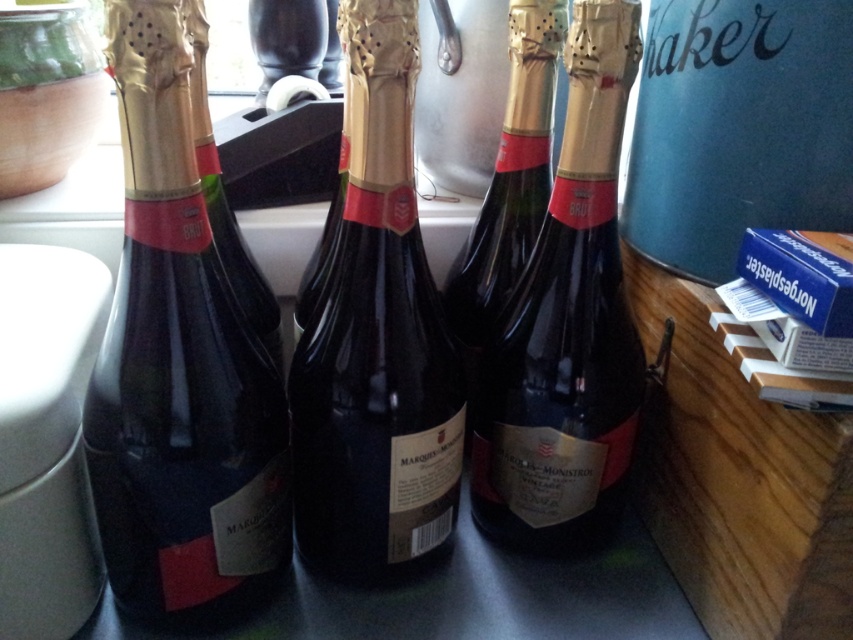
Between matte black bottle at left and matte gold foil champagne bottle at center, which one has less height?

With less height is matte gold foil champagne bottle at center.

Is matte black bottle at left taller than matte gold foil champagne bottle at center?

Indeed, matte black bottle at left has a greater height compared to matte gold foil champagne bottle at center.

Between point (248, 464) and point (403, 380), which one is positioned in front?

Point (248, 464)

The image size is (853, 640). Identify the location of matte black bottle at left. (178, 368).

Who is more forward, (234, 465) or (625, 74)?

Point (234, 465)

Does matte black bottle at left lie behind dark glass bottle at center?

No, matte black bottle at left is closer to the viewer.

Where is `matte black bottle at left`? The width and height of the screenshot is (853, 640). matte black bottle at left is located at coordinates (178, 368).

Image resolution: width=853 pixels, height=640 pixels. What do you see at coordinates (376, 340) in the screenshot?
I see `matte gold foil champagne bottle at center` at bounding box center [376, 340].

Does point (393, 60) come closer to viewer compared to point (581, 525)?

Yes.

The height and width of the screenshot is (640, 853). What are the coordinates of `matte gold foil champagne bottle at center` in the screenshot? It's located at (376, 340).